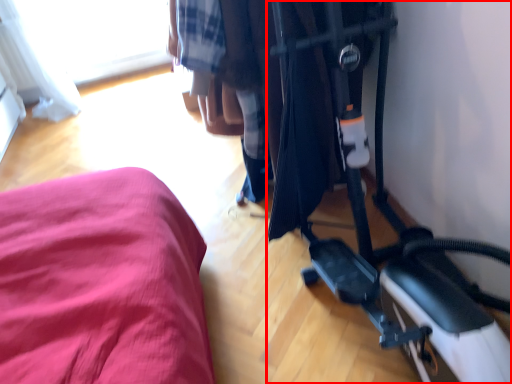
Question: From the image's perspective, what is the correct spatial positioning of baby carriage (annotated by the red box) in reference to window?

Choices:
 (A) below
 (B) above

Answer: (A)